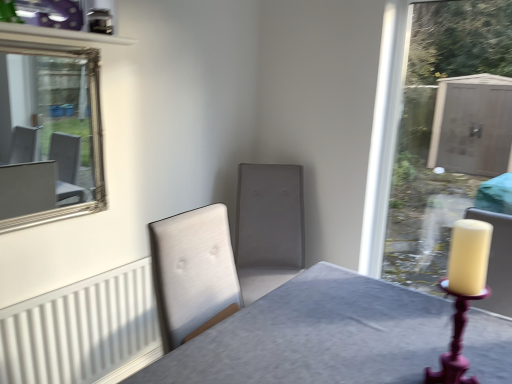
Image resolution: width=512 pixels, height=384 pixels. Describe the element at coordinates (46, 129) in the screenshot. I see `silver/glass mirror at upper left` at that location.

At what (x,y) coordinates should I click in order to perform the action: click on silver/glass mirror at upper left. Please return your answer as a coordinate pair (x, y). The width and height of the screenshot is (512, 384). Looking at the image, I should click on (46, 129).

Where is `silver/glass mirror at upper left`? The image size is (512, 384). silver/glass mirror at upper left is located at coordinates (46, 129).

In the scene shown: Considering the relative sizes of white ribbed radiator at lower left and matte gray swivel chair at center in the image provided, is white ribbed radiator at lower left shorter than matte gray swivel chair at center?

Yes.

From the image's perspective, between white ribbed radiator at lower left and matte gray swivel chair at center, which one is located above?

matte gray swivel chair at center appears higher in the image.

Based on their sizes in the image, would you say white ribbed radiator at lower left is bigger or smaller than matte gray swivel chair at center?

In the image, white ribbed radiator at lower left appears to be smaller than matte gray swivel chair at center.

Would you say white ribbed radiator at lower left contains matte gray swivel chair at center?

Actually, matte gray swivel chair at center is outside white ribbed radiator at lower left.

Who is more distant, silver/glass mirror at upper left or matte purple candle holder at right?

silver/glass mirror at upper left is behind.

How many degrees apart are the facing directions of silver/glass mirror at upper left and matte purple candle holder at right?

91.4 degrees separate the facing orientations of silver/glass mirror at upper left and matte purple candle holder at right.

Considering the positions of objects silver/glass mirror at upper left and matte purple candle holder at right in the image provided, who is more to the right, silver/glass mirror at upper left or matte purple candle holder at right?

From the viewer's perspective, matte purple candle holder at right appears more on the right side.

Identify the location of mirror above the matte purple candle holder at right (from a real-world perspective). Image resolution: width=512 pixels, height=384 pixels. (46, 129).

The image size is (512, 384). I want to click on radiator below the silver/glass mirror at upper left (from the image's perspective), so click(x=83, y=330).

Which is correct: white ribbed radiator at lower left is inside silver/glass mirror at upper left, or outside of it?

white ribbed radiator at lower left is not inside silver/glass mirror at upper left, it's outside.

From the picture: From the image's perspective, is white ribbed radiator at lower left located above or below silver/glass mirror at upper left?

Clearly, from the image's perspective, white ribbed radiator at lower left is below silver/glass mirror at upper left.

Considering the positions of objects white ribbed radiator at lower left and silver/glass mirror at upper left in the image provided, who is in front, white ribbed radiator at lower left or silver/glass mirror at upper left?

silver/glass mirror at upper left is more forward.

Which is correct: matte gray swivel chair at center is inside white ribbed radiator at lower left, or outside of it?

matte gray swivel chair at center exists outside the volume of white ribbed radiator at lower left.

From a real-world perspective, which object stands above the other?

From a 3D spatial view, matte gray swivel chair at center is above.

How different are the orientations of matte gray swivel chair at center and white ribbed radiator at lower left in degrees?

The angular difference between matte gray swivel chair at center and white ribbed radiator at lower left is 50.2 degrees.

At what (x,y) coordinates should I click in order to perform the action: click on candle holder above the matte gray swivel chair at center (from a real-world perspective). Please return your answer as a coordinate pair (x, y). The width and height of the screenshot is (512, 384). Looking at the image, I should click on (455, 343).

Is matte purple candle holder at right positioned before matte gray swivel chair at center?

That is True.

Which point is more distant from viewer, (444, 358) or (291, 270)?

The point (291, 270) is farther from the camera.

Is matte purple candle holder at right at the right side of matte gray swivel chair at center?

Indeed, matte purple candle holder at right is positioned on the right side of matte gray swivel chair at center.

Considering the sizes of objects white ribbed radiator at lower left and matte purple candle holder at right in the image provided, who is wider, white ribbed radiator at lower left or matte purple candle holder at right?

Wider between the two is matte purple candle holder at right.

From the image's perspective, would you say white ribbed radiator at lower left is shown under matte purple candle holder at right?

Yes, from the image's perspective, white ribbed radiator at lower left is beneath matte purple candle holder at right.

Is point (67, 299) closer or farther from the camera than point (454, 368)?

Clearly, point (67, 299) is more distant from the camera than point (454, 368).

Would you say white ribbed radiator at lower left is inside or outside matte purple candle holder at right?

white ribbed radiator at lower left is located beyond the bounds of matte purple candle holder at right.

Based on their sizes in the image, would you say silver/glass mirror at upper left is bigger or smaller than matte gray swivel chair at center?

silver/glass mirror at upper left is smaller than matte gray swivel chair at center.

From the picture: From the image's perspective, is silver/glass mirror at upper left over matte gray swivel chair at center?

Yes, from the image's perspective, silver/glass mirror at upper left is on top of matte gray swivel chair at center.

Considering the sizes of objects silver/glass mirror at upper left and matte gray swivel chair at center in the image provided, who is shorter, silver/glass mirror at upper left or matte gray swivel chair at center?

matte gray swivel chair at center is shorter.

From a real-world perspective, is silver/glass mirror at upper left positioned under matte gray swivel chair at center based on gravity?

No, from a real-world perspective, silver/glass mirror at upper left is not beneath matte gray swivel chair at center.

Locate an element on the screen. The height and width of the screenshot is (384, 512). swivel chair above the white ribbed radiator at lower left (from a real-world perspective) is located at coordinates (268, 227).

Locate an element on the screen. The width and height of the screenshot is (512, 384). mirror lying behind the matte purple candle holder at right is located at coordinates (46, 129).

Which object lies further to the anchor point silver/glass mirror at upper left, matte gray swivel chair at center or matte purple candle holder at right?

matte purple candle holder at right is positioned further to the anchor silver/glass mirror at upper left.

Considering their positions, is silver/glass mirror at upper left positioned closer to white ribbed radiator at lower left than matte purple candle holder at right?

silver/glass mirror at upper left lies closer to white ribbed radiator at lower left than the other object.

Consider the image. Which object lies nearer to the anchor point matte gray swivel chair at center, matte purple candle holder at right or white ribbed radiator at lower left?

white ribbed radiator at lower left lies closer to matte gray swivel chair at center than the other object.

Considering their positions, is matte purple candle holder at right positioned further to matte gray swivel chair at center than silver/glass mirror at upper left?

silver/glass mirror at upper left.

Estimate the real-world distances between objects in this image. Which object is further from silver/glass mirror at upper left, matte purple candle holder at right or matte gray swivel chair at center?

matte purple candle holder at right is positioned further to the anchor silver/glass mirror at upper left.

Looking at the image, which one is located further to white ribbed radiator at lower left, matte gray swivel chair at center or matte purple candle holder at right?

matte purple candle holder at right lies further to white ribbed radiator at lower left than the other object.

When comparing their distances from silver/glass mirror at upper left, does matte purple candle holder at right or white ribbed radiator at lower left seem further?

The object further to silver/glass mirror at upper left is matte purple candle holder at right.

Which object lies further to the anchor point matte purple candle holder at right, matte gray swivel chair at center or white ribbed radiator at lower left?

The object further to matte purple candle holder at right is white ribbed radiator at lower left.

Locate an element on the screen. This screenshot has width=512, height=384. swivel chair located between white ribbed radiator at lower left and matte purple candle holder at right in the left-right direction is located at coordinates (268, 227).

This screenshot has height=384, width=512. I want to click on radiator situated between silver/glass mirror at upper left and matte gray swivel chair at center from left to right, so click(x=83, y=330).

Where is `swivel chair between silver/glass mirror at upper left and matte purple candle holder at right`? This screenshot has height=384, width=512. swivel chair between silver/glass mirror at upper left and matte purple candle holder at right is located at coordinates (268, 227).

I want to click on radiator between silver/glass mirror at upper left and matte purple candle holder at right in the horizontal direction, so click(83, 330).